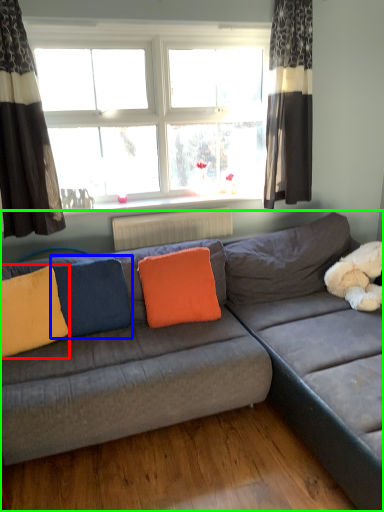
Question: Based on their relative distances, which object is nearer to pillow (highlighted by a red box)? Choose from pillow (highlighted by a blue box) and studio couch (highlighted by a green box).

Choices:
 (A) pillow
 (B) studio couch

Answer: (A)